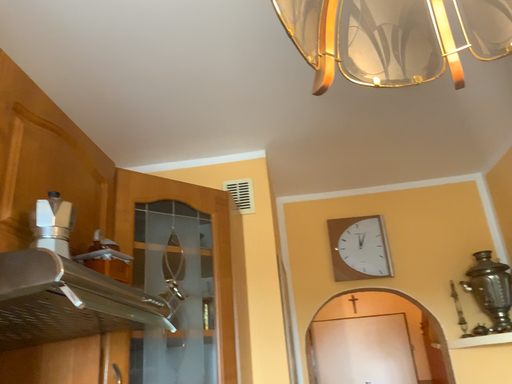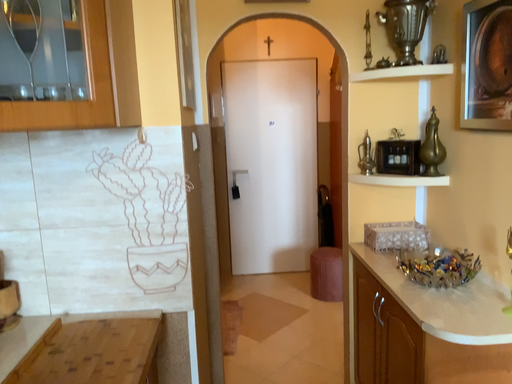
Question: How did the camera likely rotate when shooting the video?

Choices:
 (A) rotated left
 (B) rotated right

Answer: (B)